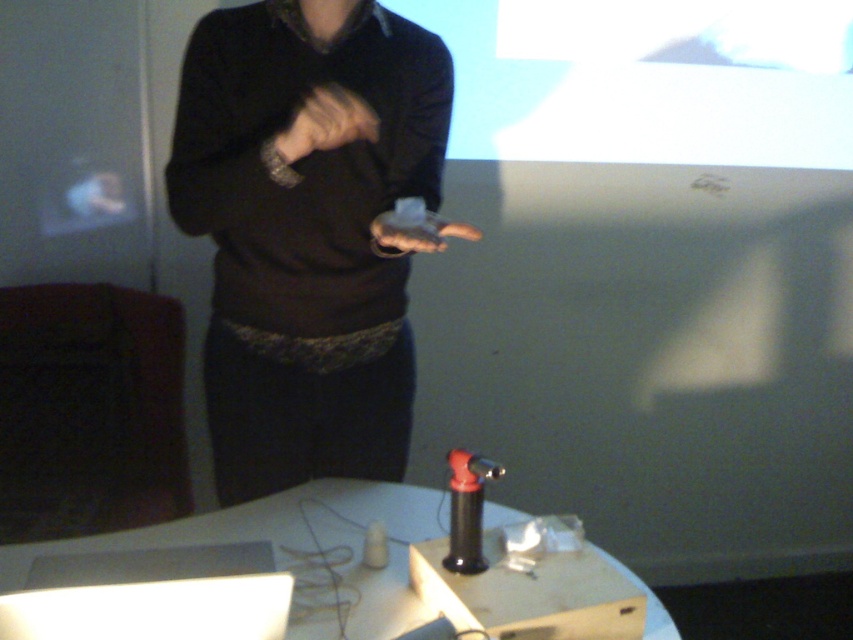
Question: Among these objects, which one is farthest from the camera?

Choices:
 (A) black matte tool at lower center
 (B) matte black hand at center
 (C) white cardboard box at center

Answer: (A)

Question: Which object is the closest to the white cardboard box at center?

Choices:
 (A) matte black hand at center
 (B) matte black shirt at center
 (C) black matte tool at lower center

Answer: (C)

Question: Is white cardboard box at center wider than black matte tool at lower center?

Choices:
 (A) no
 (B) yes

Answer: (B)

Question: From the image, what is the correct spatial relationship of white cardboard box at center in relation to matte black hand at center?

Choices:
 (A) right
 (B) left

Answer: (A)

Question: Does white cardboard box at center appear under matte black hand at center?

Choices:
 (A) yes
 (B) no

Answer: (A)

Question: Which of these objects is positioned farthest from the black matte tool at lower center?

Choices:
 (A) white cardboard box at center
 (B) matte black hand at center
 (C) matte black shirt at center

Answer: (B)